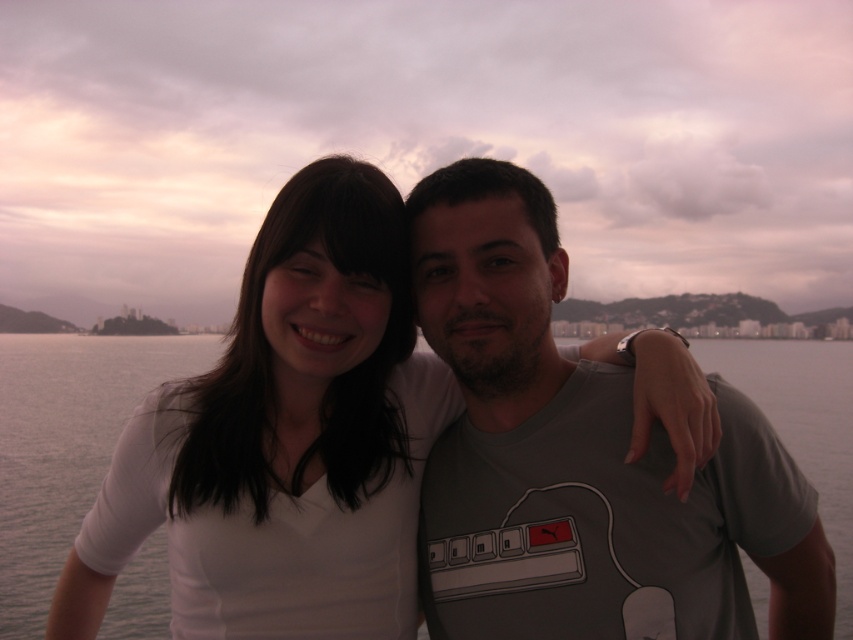
Who is positioned more to the left, gray matte t-shirt at center or gray water at center?

gray water at center is more to the left.

Find the location of a particular element. This screenshot has height=640, width=853. gray matte t-shirt at center is located at coordinates (585, 445).

Identify the location of gray matte t-shirt at center. (585, 445).